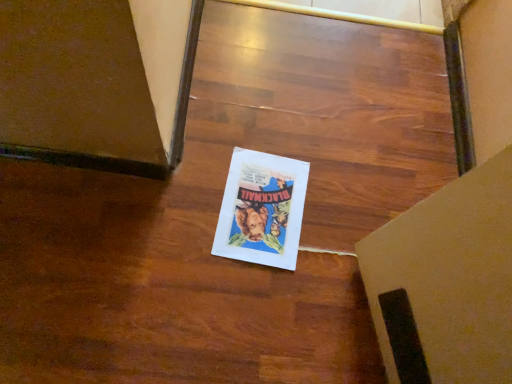
Where is `free space behind matte paper poster at center`? The height and width of the screenshot is (384, 512). free space behind matte paper poster at center is located at coordinates (281, 125).